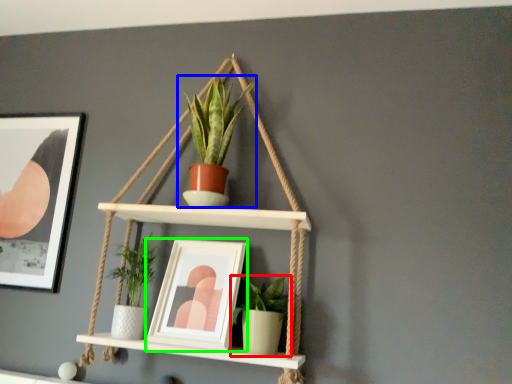
Question: Which object is positioned farthest from houseplant (highlighted by a red box)? Select from houseplant (highlighted by a blue box) and picture frame (highlighted by a green box).

Choices:
 (A) houseplant
 (B) picture frame

Answer: (A)